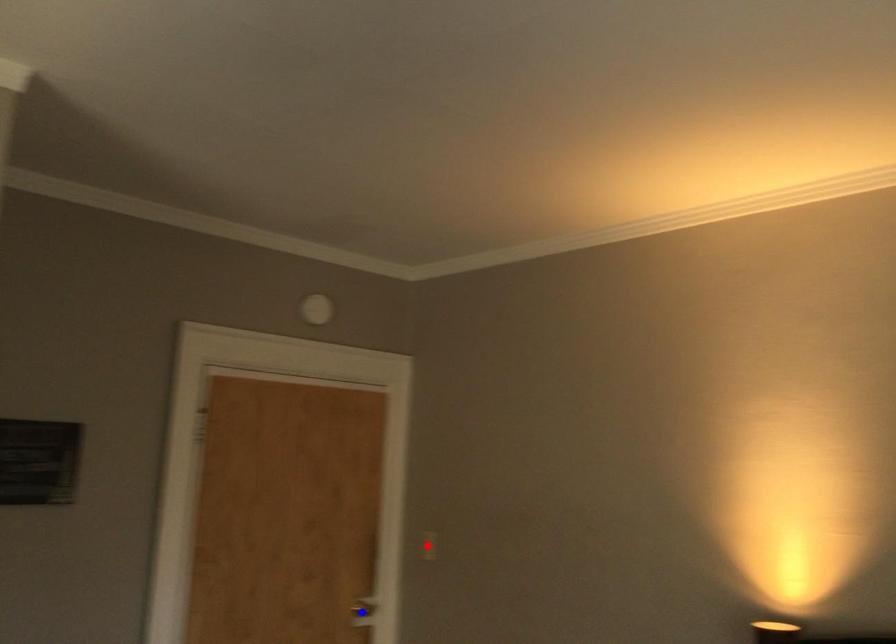
Question: Which of the two points in the image is closer to the camera?

Choices:
 (A) Blue point is closer.
 (B) Red point is closer.

Answer: (A)